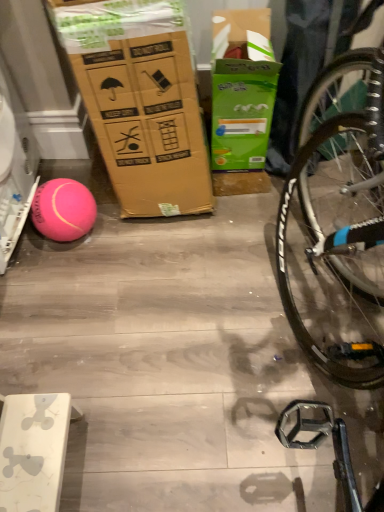
Question: From a real-world perspective, is green cardboard box at upper center physically below pink rubber ball at left?

Choices:
 (A) no
 (B) yes

Answer: (A)

Question: From a real-world perspective, is green cardboard box at upper center on pink rubber ball at left?

Choices:
 (A) no
 (B) yes

Answer: (B)

Question: From the image's perspective, is green cardboard box at upper center beneath pink rubber ball at left?

Choices:
 (A) no
 (B) yes

Answer: (A)

Question: Can you confirm if green cardboard box at upper center is shorter than pink rubber ball at left?

Choices:
 (A) yes
 (B) no

Answer: (B)

Question: Does green cardboard box at upper center have a larger size compared to pink rubber ball at left?

Choices:
 (A) yes
 (B) no

Answer: (A)

Question: Is green cardboard box at upper center thinner than pink rubber ball at left?

Choices:
 (A) no
 (B) yes

Answer: (A)

Question: Considering the relative sizes of pink rubber ball at left and green cardboard box at upper center in the image provided, is pink rubber ball at left shorter than green cardboard box at upper center?

Choices:
 (A) yes
 (B) no

Answer: (A)

Question: Considering the relative positions of pink rubber ball at left and green cardboard box at upper center in the image provided, is pink rubber ball at left behind green cardboard box at upper center?

Choices:
 (A) no
 (B) yes

Answer: (B)

Question: From a real-world perspective, is pink rubber ball at left under green cardboard box at upper center?

Choices:
 (A) yes
 (B) no

Answer: (A)

Question: Could you tell me if pink rubber ball at left is turned towards green cardboard box at upper center?

Choices:
 (A) no
 (B) yes

Answer: (A)

Question: From the image's perspective, is pink rubber ball at left under green cardboard box at upper center?

Choices:
 (A) no
 (B) yes

Answer: (B)

Question: Could green cardboard box at upper center be considered to be inside pink rubber ball at left?

Choices:
 (A) no
 (B) yes

Answer: (A)

Question: Looking at their shapes, would you say pink rubber ball at left is wider or thinner than green cardboard box at upper center?

Choices:
 (A) wide
 (B) thin

Answer: (B)